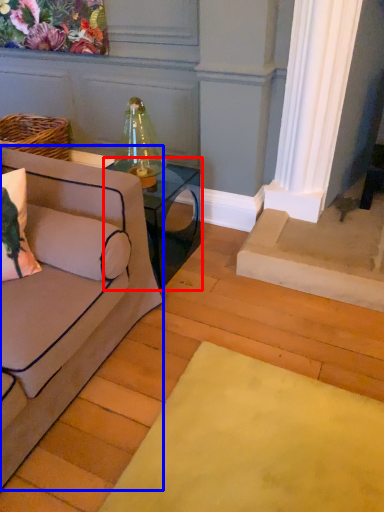
Question: Which object is closer to the camera taking this photo, table (highlighted by a red box) or studio couch (highlighted by a blue box)?

Choices:
 (A) table
 (B) studio couch

Answer: (B)